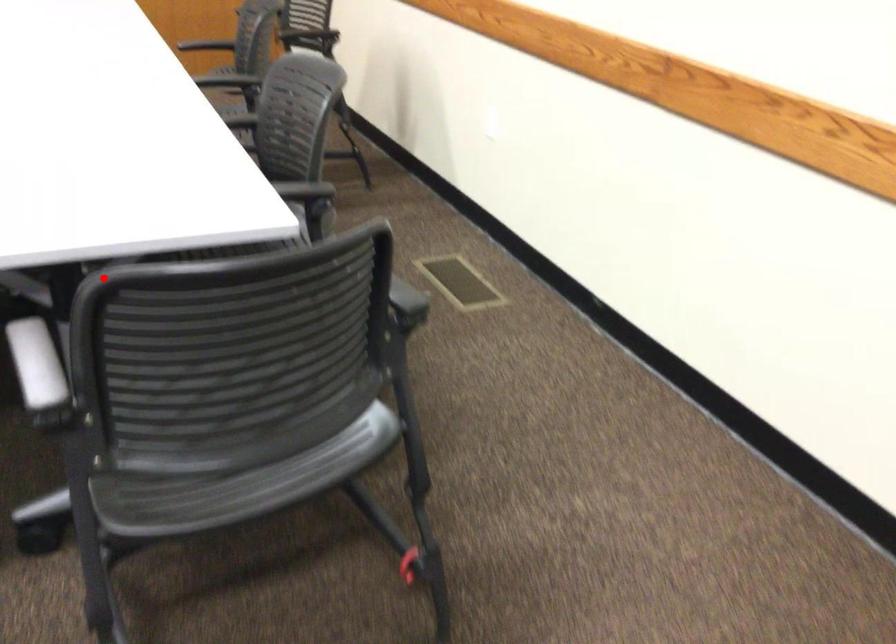
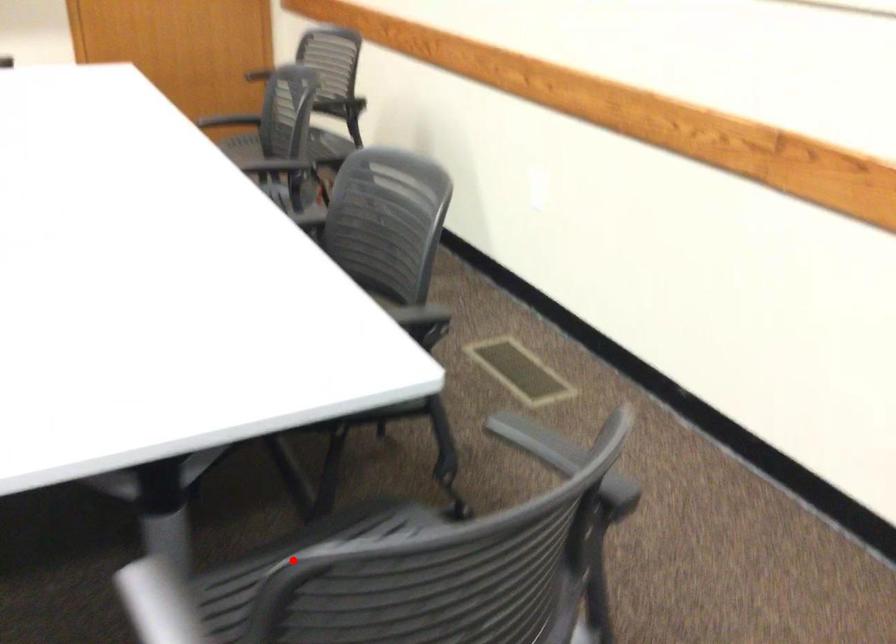
I am providing you with two images of the same scene from different viewpoints. A red point is marked on the first image and another point is marked on the second image. Does the point marked in image1 correspond to the same location as the one in image2?

Yes